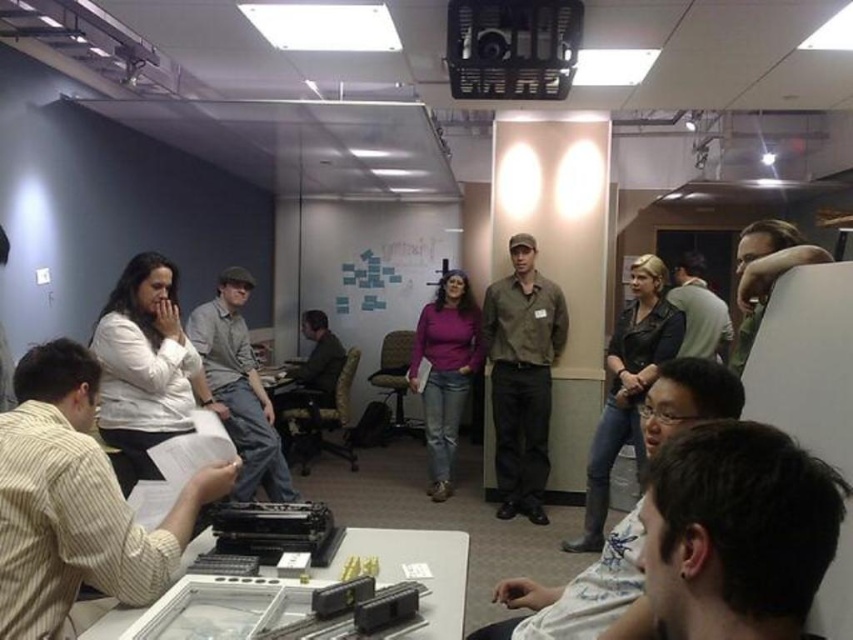
Question: Which of the following is the farthest from the observer?

Choices:
 (A) denim jacket at center
 (B) white matte shirt at center

Answer: (A)

Question: Which object appears farthest from the camera in this image?

Choices:
 (A) striped cotton shirt at lower left
 (B) dark brown hair at lower right
 (C) dark gray fabric chair at center

Answer: (C)

Question: Does dark brown leather jacket at center have a smaller size compared to denim jacket at center?

Choices:
 (A) no
 (B) yes

Answer: (B)

Question: Can you confirm if dark brown hair at lower right is positioned above matte brown shirt at center?

Choices:
 (A) yes
 (B) no

Answer: (A)

Question: Is purple matte shirt at center closer to camera compared to dark brown leather jacket at upper right?

Choices:
 (A) no
 (B) yes

Answer: (A)

Question: Which of these objects is positioned closest to the denim jacket at center?

Choices:
 (A) white matte shirt at center
 (B) dark gray sweater at upper right
 (C) dark brown leather jacket at center

Answer: (B)